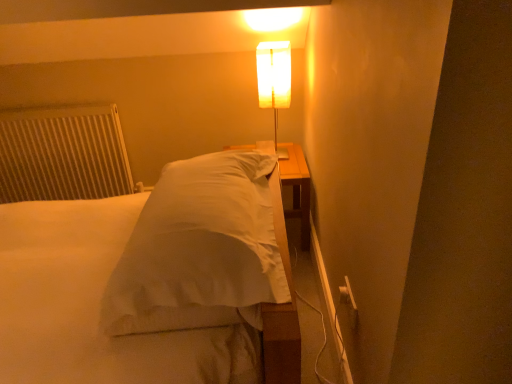
Question: Can you confirm if white satin bed at center is bigger than translucent white lamp at upper center?

Choices:
 (A) yes
 (B) no

Answer: (A)

Question: Considering the relative sizes of white satin bed at center and translucent white lamp at upper center in the image provided, is white satin bed at center wider than translucent white lamp at upper center?

Choices:
 (A) yes
 (B) no

Answer: (A)

Question: Is white satin bed at center facing towards translucent white lamp at upper center?

Choices:
 (A) yes
 (B) no

Answer: (B)

Question: From a real-world perspective, is white satin bed at center physically below translucent white lamp at upper center?

Choices:
 (A) yes
 (B) no

Answer: (A)

Question: Considering the relative sizes of white satin bed at center and translucent white lamp at upper center in the image provided, is white satin bed at center taller than translucent white lamp at upper center?

Choices:
 (A) no
 (B) yes

Answer: (A)

Question: Based on their positions, is white satin bed at center located to the left or right of white textured radiator at left?

Choices:
 (A) left
 (B) right

Answer: (B)

Question: Is point (188, 314) positioned closer to the camera than point (47, 157)?

Choices:
 (A) farther
 (B) closer

Answer: (B)

Question: Is white satin bed at center taller or shorter than white textured radiator at left?

Choices:
 (A) short
 (B) tall

Answer: (A)

Question: Relative to white textured radiator at left, is white satin bed at center in front or behind?

Choices:
 (A) front
 (B) behind

Answer: (A)

Question: Is translucent white lamp at upper center in front of or behind white satin bed at center in the image?

Choices:
 (A) front
 (B) behind

Answer: (B)

Question: Would you say translucent white lamp at upper center is inside or outside white satin bed at center?

Choices:
 (A) inside
 (B) outside

Answer: (B)

Question: Is translucent white lamp at upper center wider or thinner than white satin bed at center?

Choices:
 (A) thin
 (B) wide

Answer: (A)

Question: From a real-world perspective, is translucent white lamp at upper center above or below white satin bed at center?

Choices:
 (A) above
 (B) below

Answer: (A)

Question: Looking at their shapes, would you say white textured radiator at left is wider or thinner than translucent white lamp at upper center?

Choices:
 (A) thin
 (B) wide

Answer: (A)

Question: From a real-world perspective, relative to translucent white lamp at upper center, is white textured radiator at left vertically above or below?

Choices:
 (A) above
 (B) below

Answer: (B)